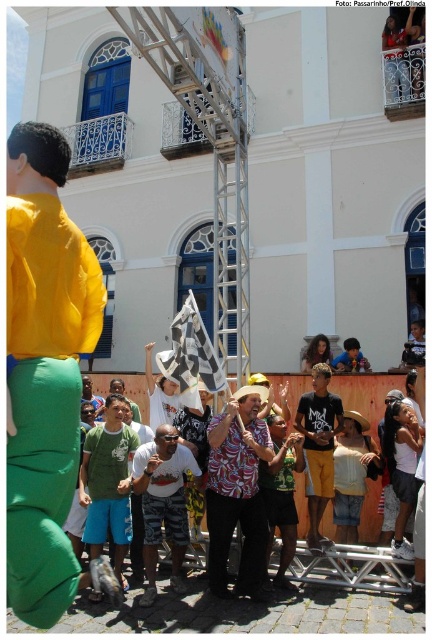
You are a photographer trying to capture a clear shot of the crowd at this event. You notice the matte yellow jacket at left and the green fabric shirt at center. Which object is blocking your view of the other?

The matte yellow jacket at left is located above the green fabric shirt at center, so the matte yellow jacket at left is blocking the view of the green fabric shirt at center.

You are a photographer standing at the back of the crowd in the image. You want to take a photo that includes both the camouflage shorts at center and the dark blue cotton shirt at center. Given that your camera has a maximum zoom range of 10 meters, will you be able to capture both objects in a single frame without moving closer?

The camouflage shorts at center and dark blue cotton shirt at center are 8.57 meters apart. Since the camera has a maximum zoom range of 10 meters, which is greater than the distance between them, you can capture both in a single frame without moving closer.